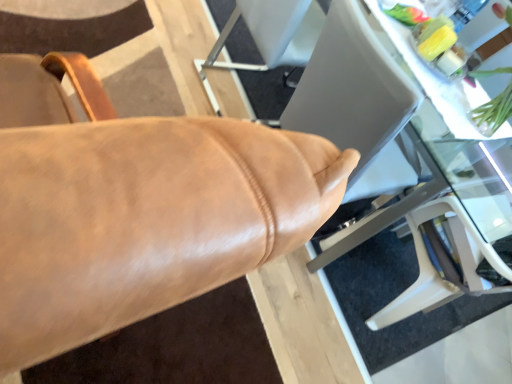
Question: Considering the relative sizes of transparent glass table at center and green leafy plant at upper right in the image provided, is transparent glass table at center taller than green leafy plant at upper right?

Choices:
 (A) yes
 (B) no

Answer: (A)

Question: Is transparent glass table at center further to camera compared to green leafy plant at upper right?

Choices:
 (A) yes
 (B) no

Answer: (B)

Question: Is the depth of transparent glass table at center less than that of green leafy plant at upper right?

Choices:
 (A) yes
 (B) no

Answer: (A)

Question: Does transparent glass table at center appear on the right side of green leafy plant at upper right?

Choices:
 (A) yes
 (B) no

Answer: (B)

Question: From a real-world perspective, does transparent glass table at center sit lower than green leafy plant at upper right?

Choices:
 (A) no
 (B) yes

Answer: (B)

Question: Considering the positions of green leafy plant at upper right and transparent glass table at center in the image, is green leafy plant at upper right wider or thinner than transparent glass table at center?

Choices:
 (A) wide
 (B) thin

Answer: (B)

Question: Is green leafy plant at upper right taller or shorter than transparent glass table at center?

Choices:
 (A) tall
 (B) short

Answer: (B)

Question: Does point (486, 132) appear closer or farther from the camera than point (316, 74)?

Choices:
 (A) closer
 (B) farther

Answer: (B)

Question: From the image's perspective, is green leafy plant at upper right above or below transparent glass table at center?

Choices:
 (A) below
 (B) above

Answer: (B)

Question: Which is correct: leather chair at center is inside green leafy plant at upper right, or outside of it?

Choices:
 (A) inside
 (B) outside

Answer: (B)

Question: From their relative heights in the image, would you say leather chair at center is taller or shorter than green leafy plant at upper right?

Choices:
 (A) tall
 (B) short

Answer: (A)

Question: In the image, is leather chair at center positioned in front of or behind green leafy plant at upper right?

Choices:
 (A) behind
 (B) front

Answer: (B)

Question: Based on their positions, is leather chair at center located to the left or right of green leafy plant at upper right?

Choices:
 (A) left
 (B) right

Answer: (A)

Question: In terms of height, does transparent glass table at center look taller or shorter compared to leather chair at center?

Choices:
 (A) tall
 (B) short

Answer: (B)

Question: Relative to leather chair at center, is transparent glass table at center in front or behind?

Choices:
 (A) behind
 (B) front

Answer: (A)